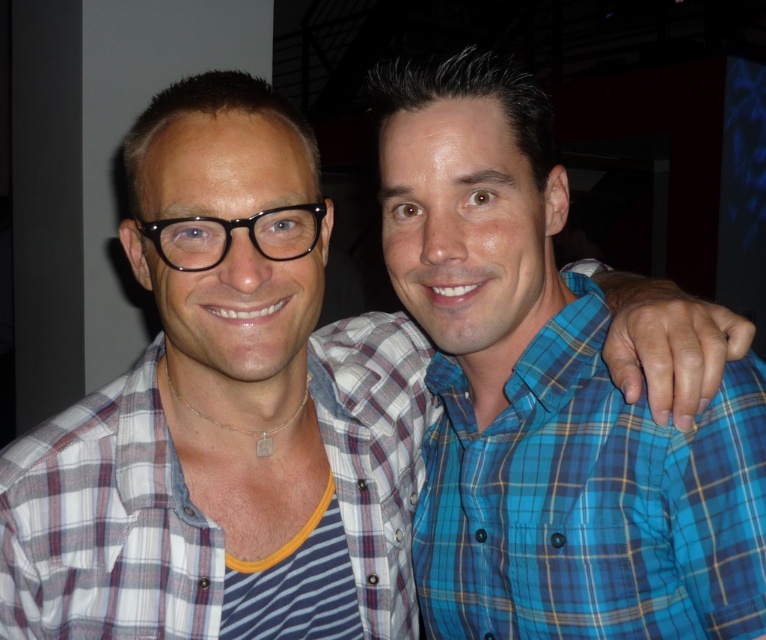
Based on the photo, you are standing in front of the two people in the image. You want to hand a gift card to the person wearing the blue plaid shirt at right without touching them. Can you do this while staying where you are?

The blue plaid shirt at right is 60.36 centimeters away from the viewer. Since 60.36 centimeters is approximately 2 feet, you can reach out and hand the gift card to the person wearing the blue plaid shirt at right without needing to move closer.

You are taking a photo of two people wearing plaid shirts. The blue plaid shirt at right and the white plaid shirt at center. Which person is closer to the camera?

The blue plaid shirt at right is smaller than the white plaid shirt at center, so the person wearing the white plaid shirt at center is closer to the camera.